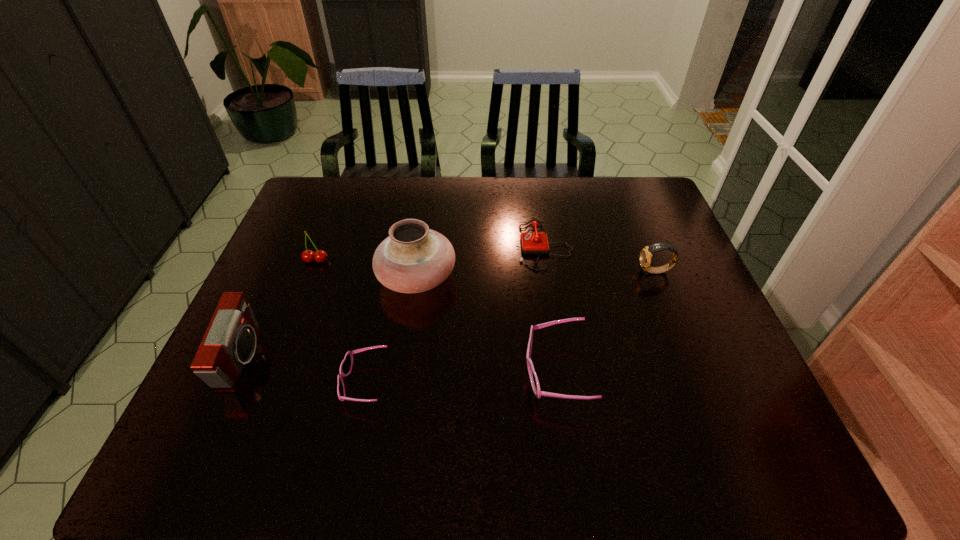
Locate an element on the screen. Image resolution: width=960 pixels, height=540 pixels. free space between the third shortest object and the sixth tallest object is located at coordinates (550, 309).

Image resolution: width=960 pixels, height=540 pixels. I want to click on free space between the rightmost object and the pottery, so click(x=537, y=274).

Where is `free spot between the rightmost object and the second shortest object`? free spot between the rightmost object and the second shortest object is located at coordinates (600, 258).

Select which object appears as the fifth closest to the tallest object. Please provide its 2D coordinates. Your answer should be formatted as a tuple, i.e. [(x, y)], where the tuple contains the x and y coordinates of a point satisfying the conditions above.

[(229, 342)]

Locate which object ranks third in proximity to the shorter sunglasses. Please provide its 2D coordinates. Your answer should be formatted as a tuple, i.e. [(x, y)], where the tuple contains the x and y coordinates of a point satisfying the conditions above.

[(538, 393)]

The height and width of the screenshot is (540, 960). I want to click on free spot that satisfies the following two spatial constraints: 1. with the stems of the cherry pointing upwards; 2. on the front-facing side of the camera, so coord(278,358).

Find the location of `free location that satisfies the following two spatial constraints: 1. on the dial of the second shortest object; 2. with the stems of the sixth object from right to left pointing upwards`. free location that satisfies the following two spatial constraints: 1. on the dial of the second shortest object; 2. with the stems of the sixth object from right to left pointing upwards is located at coordinates (547, 260).

Identify the location of free space that satisfies the following two spatial constraints: 1. on the dial of the telephone; 2. with the stems of the cherry pointing upwards. (547, 260).